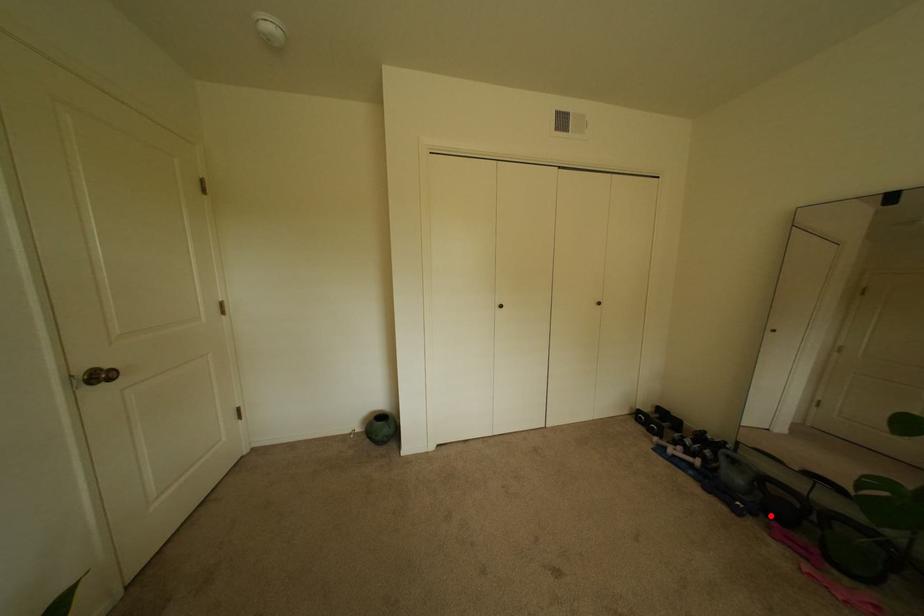
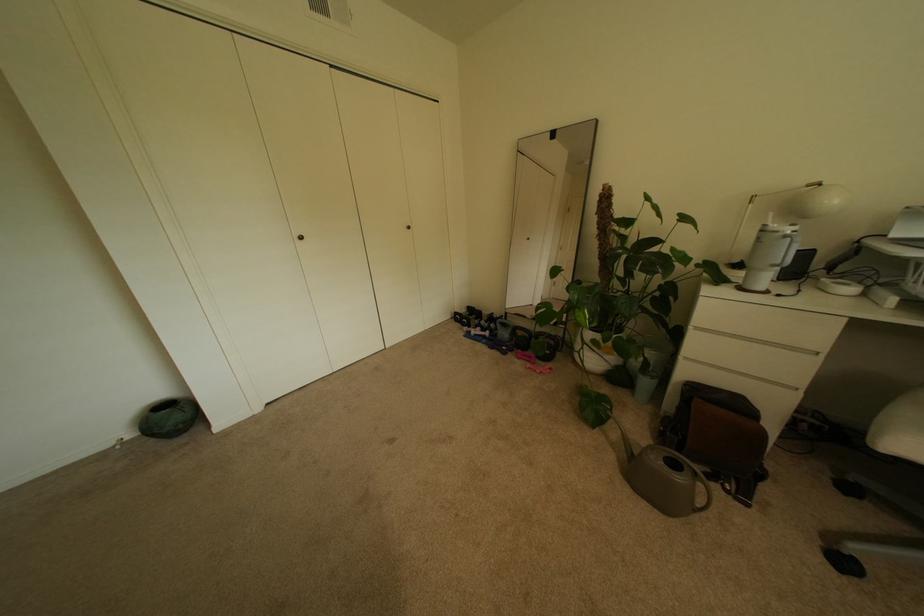
Question: I am providing you with two images of the same scene from different viewpoints. A red point is shown in image1. For the corresponding object point in image2, is it positioned nearer or farther from the camera?

Choices:
 (A) Nearer
 (B) Farther

Answer: (B)